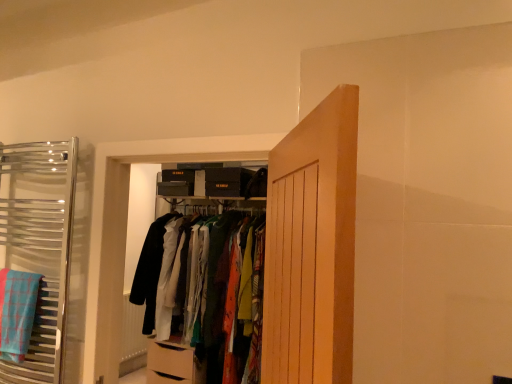
Question: Considering the relative sizes of matte fabric clothes at center, the 2th closet when ordered from front to back, and chrome towel rack at left, the second closet positioned from the right, in the image provided, is matte fabric clothes at center, the 2th closet when ordered from front to back, shorter than chrome towel rack at left, the second closet positioned from the right,?

Choices:
 (A) yes
 (B) no

Answer: (B)

Question: Is matte fabric clothes at center, the 2th closet when ordered from front to back, oriented away from chrome towel rack at left, the second closet positioned from the right?

Choices:
 (A) yes
 (B) no

Answer: (B)

Question: Is the surface of matte fabric clothes at center, which appears as the 1th closet when viewed from the back, in direct contact with chrome towel rack at left, acting as the 1th closet starting from the front?

Choices:
 (A) no
 (B) yes

Answer: (A)

Question: Is matte fabric clothes at center, the 2th closet when ordered from front to back, wider than chrome towel rack at left, the second closet positioned from the right?

Choices:
 (A) yes
 (B) no

Answer: (A)

Question: Considering the relative sizes of matte fabric clothes at center, the 2th closet when ordered from front to back, and chrome towel rack at left, the second closet positioned from the right, in the image provided, is matte fabric clothes at center, the 2th closet when ordered from front to back, thinner than chrome towel rack at left, the second closet positioned from the right,?

Choices:
 (A) yes
 (B) no

Answer: (B)

Question: Would you say blue plaid bath towel at left is to the left or to the right of matte fabric clothes at center, the 2th closet from the left, in the picture?

Choices:
 (A) right
 (B) left

Answer: (B)

Question: In terms of height, does blue plaid bath towel at left look taller or shorter compared to matte fabric clothes at center, which is counted as the 1th closet, starting from the right?

Choices:
 (A) short
 (B) tall

Answer: (A)

Question: From a real-world perspective, is blue plaid bath towel at left above or below matte fabric clothes at center, which appears as the 1th closet when viewed from the back?

Choices:
 (A) above
 (B) below

Answer: (A)

Question: Is blue plaid bath towel at left in front of or behind matte fabric clothes at center, the 2th closet when ordered from front to back, in the image?

Choices:
 (A) behind
 (B) front

Answer: (B)

Question: Is point (268, 324) closer or farther from the camera than point (247, 218)?

Choices:
 (A) farther
 (B) closer

Answer: (B)

Question: Is wooden door at center in front of or behind matte fabric clothes at center, which is counted as the 1th closet, starting from the right, in the image?

Choices:
 (A) front
 (B) behind

Answer: (A)

Question: Looking at their shapes, would you say wooden door at center is wider or thinner than matte fabric clothes at center, the 2th closet from the left?

Choices:
 (A) thin
 (B) wide

Answer: (A)

Question: Considering the positions of wooden door at center and matte fabric clothes at center, which is counted as the 1th closet, starting from the right, in the image, is wooden door at center bigger or smaller than matte fabric clothes at center, which is counted as the 1th closet, starting from the right,?

Choices:
 (A) big
 (B) small

Answer: (B)

Question: From a real-world perspective, is blue plaid bath towel at left positioned above or below wooden door at center?

Choices:
 (A) above
 (B) below

Answer: (B)

Question: Is blue plaid bath towel at left bigger or smaller than wooden door at center?

Choices:
 (A) small
 (B) big

Answer: (A)